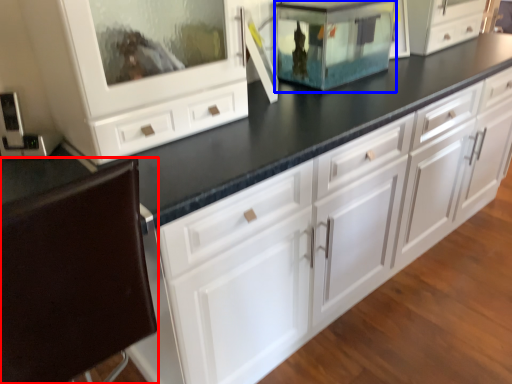
Question: Which object appears closest to the camera in this image, cabinetry (highlighted by a red box) or appliance (highlighted by a blue box)?

Choices:
 (A) cabinetry
 (B) appliance

Answer: (A)